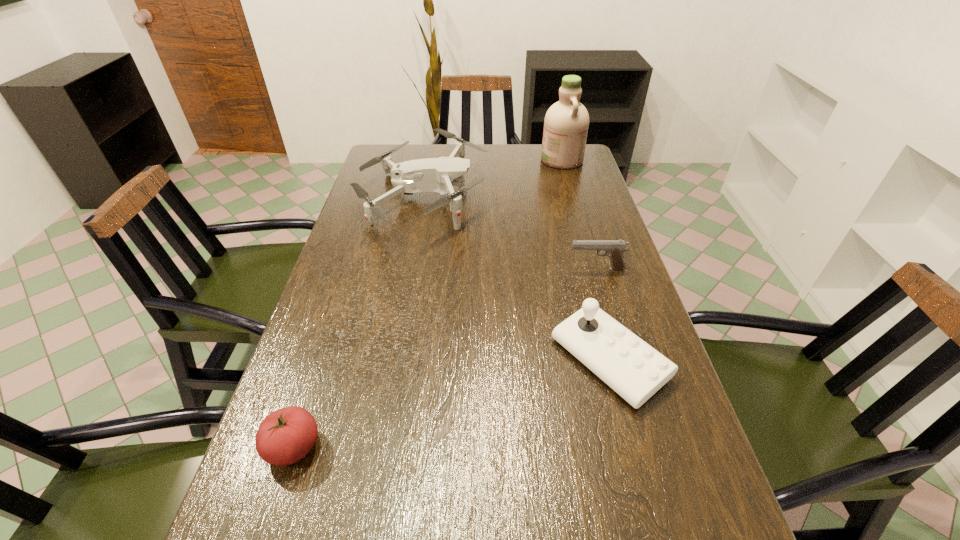
Where is `free space between the drone and the pistol`? free space between the drone and the pistol is located at coordinates (510, 234).

You are a GUI agent. You are given a task and a screenshot of the screen. Output one action in this format:
    pyautogui.click(x=<x>, y=<y>)
    Task: Click on the free point between the drone and the tomato
    
    Given the screenshot: What is the action you would take?
    pyautogui.click(x=358, y=323)

Where is `object that is the fifth closest one to the drone`? object that is the fifth closest one to the drone is located at coordinates (670, 539).

This screenshot has height=540, width=960. What are the coordinates of `object that is the third closest to the third nearest object` in the screenshot? It's located at (432, 174).

This screenshot has width=960, height=540. I want to click on free point that satisfies the following two spatial constraints: 1. with a camera at the front of the joystick; 2. on the right side of the drone, so click(394, 360).

Identify the location of vacant position in the image that satisfies the following two spatial constraints: 1. on the back side of the joystick; 2. with a camera at the front of the drone. Image resolution: width=960 pixels, height=540 pixels. (566, 199).

Find the location of a particular element. This screenshot has width=960, height=540. vacant space that satisfies the following two spatial constraints: 1. with a camera at the front of the joystick; 2. on the left side of the drone is located at coordinates (394, 360).